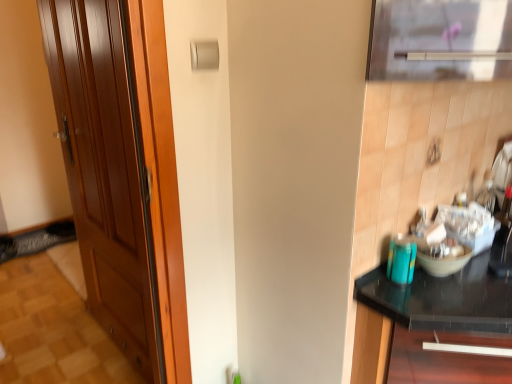
Identify the location of free space above black glass countertop at right (from a real-world perspective). The image size is (512, 384). (467, 290).